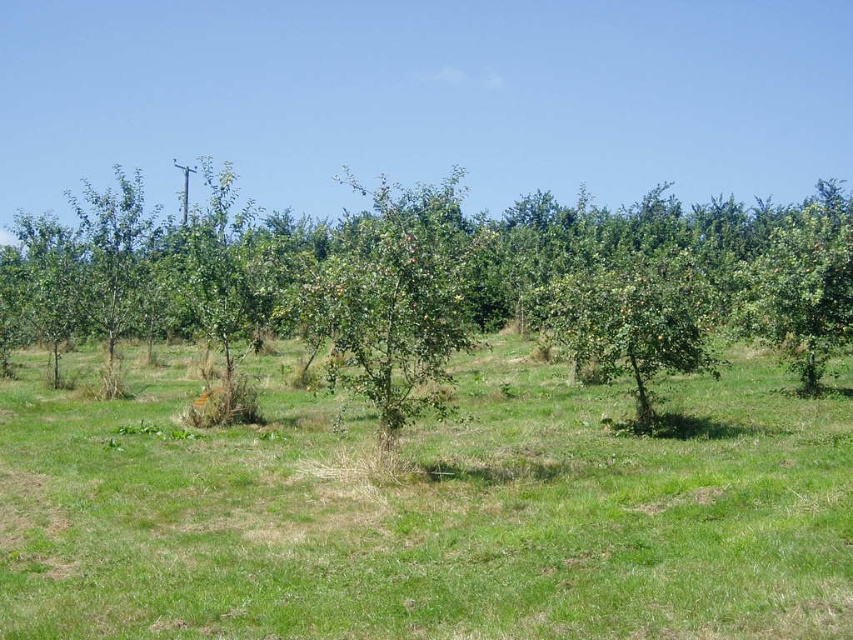
Looking at this image, is green grass at center to the left of green leafy tree at center from the viewer's perspective?

Yes, green grass at center is to the left of green leafy tree at center.

Can you confirm if green grass at center is shorter than green leafy tree at center?

Indeed, green grass at center has a lesser height compared to green leafy tree at center.

Identify the location of green grass at center. This screenshot has width=853, height=640. (428, 513).

The height and width of the screenshot is (640, 853). I want to click on green grass at center, so click(x=428, y=513).